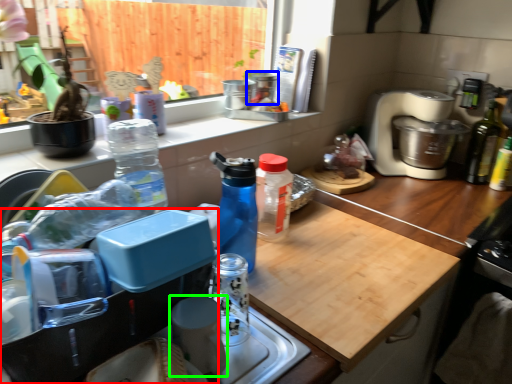
Question: Considering the real-world distances, which object is farthest from kitchen appliance (highlighted by a red box)? appliance (highlighted by a blue box) or appliance (highlighted by a green box)?

Choices:
 (A) appliance
 (B) appliance

Answer: (A)